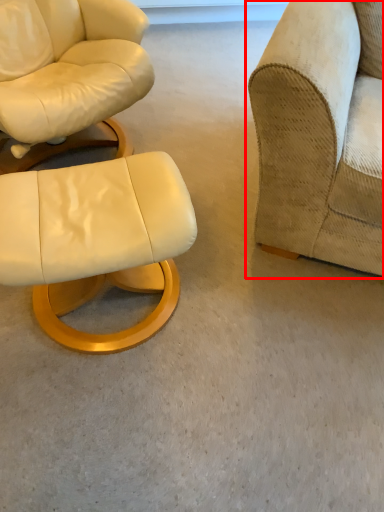
Question: In this image, where is studio couch (annotated by the red box) located relative to chair?

Choices:
 (A) right
 (B) left

Answer: (A)